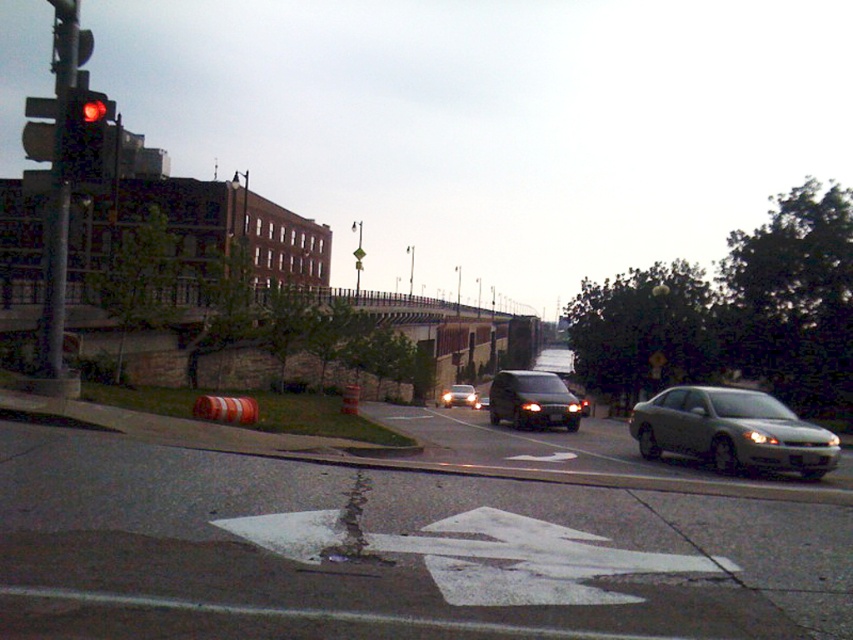
Between satin silver sedan at right and satin black van at center, which one has more height?

satin black van at center is taller.

Locate an element on the screen. This screenshot has height=640, width=853. satin silver sedan at right is located at coordinates (732, 432).

Which is in front, point (514, 410) or point (97, 138)?

Point (97, 138) is in front.

Between point (526, 385) and point (77, 109), which one is positioned in front?

Point (77, 109) is more forward.

At what (x,y) coordinates should I click in order to perform the action: click on matte black van at center. Please return your answer as a coordinate pair (x, y). Looking at the image, I should click on (532, 401).

Does red glass traffic light at left appear on the left side of satin black van at center?

Correct, you'll find red glass traffic light at left to the left of satin black van at center.

Looking at this image, does red glass traffic light at left have a larger size compared to satin black van at center?

No.

Find the location of a particular element. This screenshot has height=640, width=853. red glass traffic light at left is located at coordinates (86, 136).